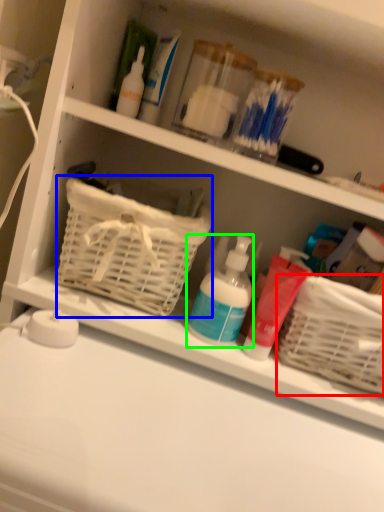
Question: Which object is positioned closest to basket (highlighted by a red box)? Select from basket (highlighted by a blue box) and cleaning product (highlighted by a green box).

Choices:
 (A) basket
 (B) cleaning product

Answer: (B)